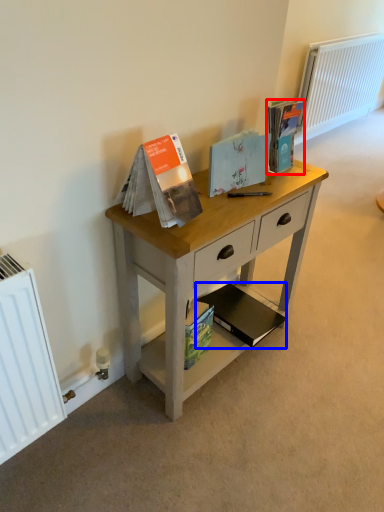
Question: Which object appears farthest to the camera in this image, paperback book (highlighted by a red box) or paperback book (highlighted by a blue box)?

Choices:
 (A) paperback book
 (B) paperback book

Answer: (B)